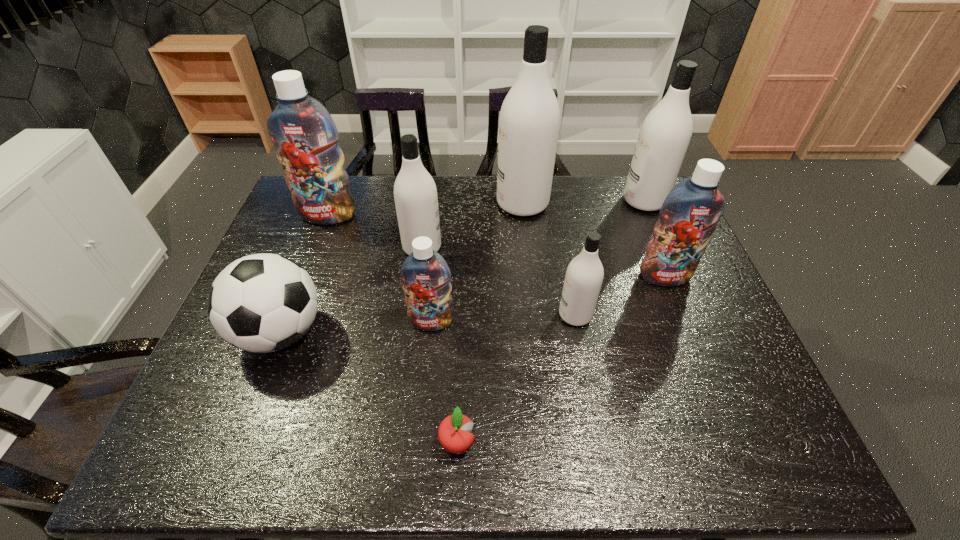
I want to click on free point located 0.310m on the front-facing side of the second biggest white shampoo, so click(x=531, y=201).

Locate an element on the screen. The width and height of the screenshot is (960, 540). free spot located on the front-facing side of the second biggest white shampoo is located at coordinates (516, 201).

Identify the location of blank space located on the front label of the leftmost shampoo. The width and height of the screenshot is (960, 540). (309, 266).

Find the location of a particular element. The image size is (960, 540). vacant space located 0.230m on the front-facing side of the second nearest white shampoo is located at coordinates (518, 247).

Locate an element on the screen. The width and height of the screenshot is (960, 540). free region located on the front label of the second nearest blue shampoo is located at coordinates (693, 348).

This screenshot has height=540, width=960. Identify the location of vacant space situated on the front-facing side of the nearest white shampoo. (473, 315).

Find the location of a particular element. free spot located on the front-facing side of the nearest white shampoo is located at coordinates (516, 315).

Identify the location of vacant space located on the front-facing side of the nearest white shampoo. (505, 315).

Locate an element on the screen. free space located 0.280m on the front label of the smallest blue shampoo is located at coordinates (420, 441).

I want to click on vacant space located 0.130m on the front of the soccer ball, so click(x=245, y=426).